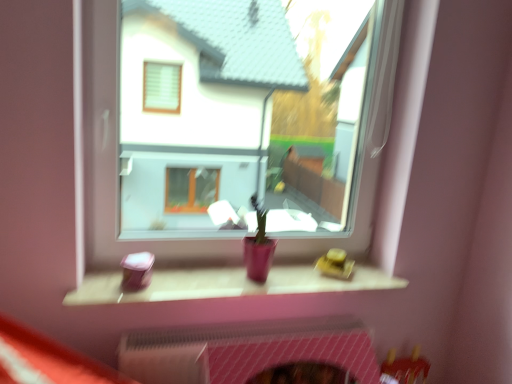
Question: Is pink mesh fireplace at lower center behind matte pink wood at center?

Choices:
 (A) no
 (B) yes

Answer: (B)

Question: Is pink mesh fireplace at lower center at the left side of matte pink wood at center?

Choices:
 (A) yes
 (B) no

Answer: (B)

Question: From a real-world perspective, is pink mesh fireplace at lower center on matte pink wood at center?

Choices:
 (A) yes
 (B) no

Answer: (B)

Question: Considering the relative sizes of pink mesh fireplace at lower center and matte pink wood at center in the image provided, is pink mesh fireplace at lower center thinner than matte pink wood at center?

Choices:
 (A) yes
 (B) no

Answer: (A)

Question: From the image's perspective, would you say pink mesh fireplace at lower center is shown under matte pink wood at center?

Choices:
 (A) yes
 (B) no

Answer: (A)

Question: Visually, is transparent glass window at center positioned to the left or to the right of matte pink wood at center?

Choices:
 (A) left
 (B) right

Answer: (B)

Question: Is point (95, 44) positioned closer to the camera than point (254, 292)?

Choices:
 (A) closer
 (B) farther

Answer: (A)

Question: Based on their sizes in the image, would you say transparent glass window at center is bigger or smaller than matte pink wood at center?

Choices:
 (A) small
 (B) big

Answer: (B)

Question: Is transparent glass window at center spatially inside matte pink wood at center, or outside of it?

Choices:
 (A) outside
 (B) inside

Answer: (A)

Question: Does point (336, 355) appear closer or farther from the camera than point (324, 249)?

Choices:
 (A) farther
 (B) closer

Answer: (B)

Question: In terms of size, does pink mesh fireplace at lower center appear bigger or smaller than transparent glass window at center?

Choices:
 (A) big
 (B) small

Answer: (B)

Question: Is pink mesh fireplace at lower center in front of or behind transparent glass window at center in the image?

Choices:
 (A) front
 (B) behind

Answer: (B)

Question: Is pink mesh fireplace at lower center taller or shorter than transparent glass window at center?

Choices:
 (A) short
 (B) tall

Answer: (A)

Question: Considering their positions, is pink mesh fireplace at lower center located in front of or behind matte pink wood at center?

Choices:
 (A) behind
 (B) front

Answer: (A)

Question: Is point (292, 349) closer or farther from the camera than point (245, 284)?

Choices:
 (A) closer
 (B) farther

Answer: (A)